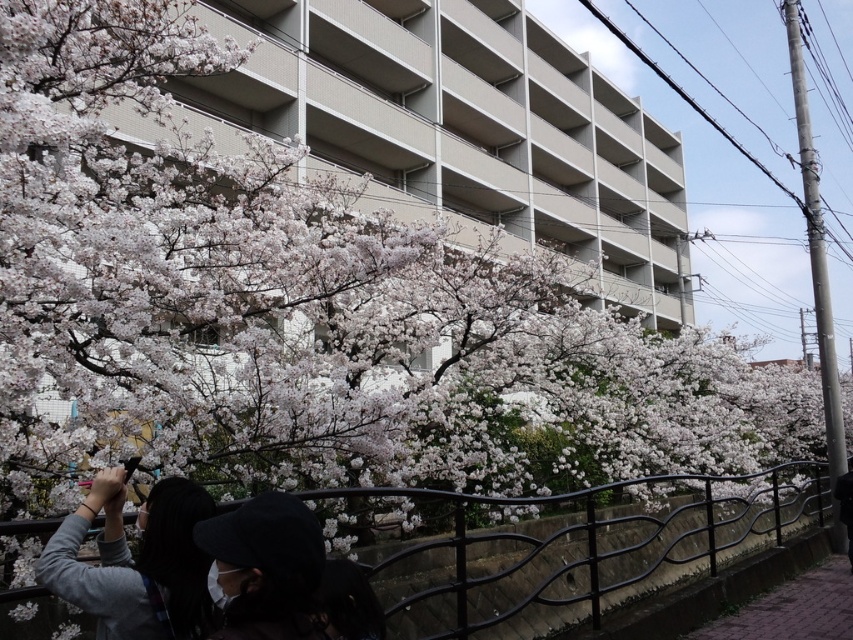
Can you confirm if black metal fence at lower center is positioned to the right of gray fabric jacket at lower left?

Yes, black metal fence at lower center is to the right of gray fabric jacket at lower left.

At what (x,y) coordinates should I click in order to perform the action: click on black metal fence at lower center. Please return your answer as a coordinate pair (x, y). This screenshot has width=853, height=640. Looking at the image, I should click on (575, 544).